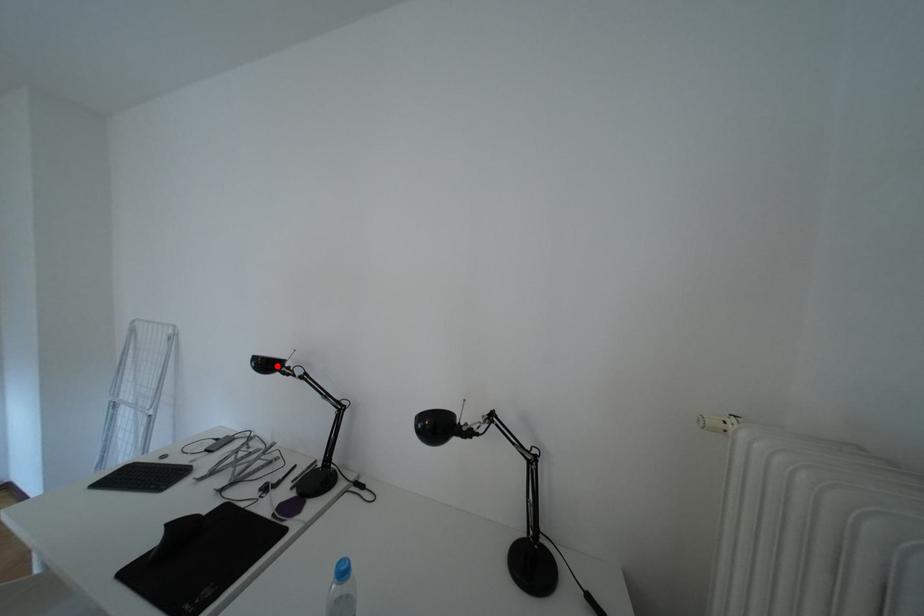
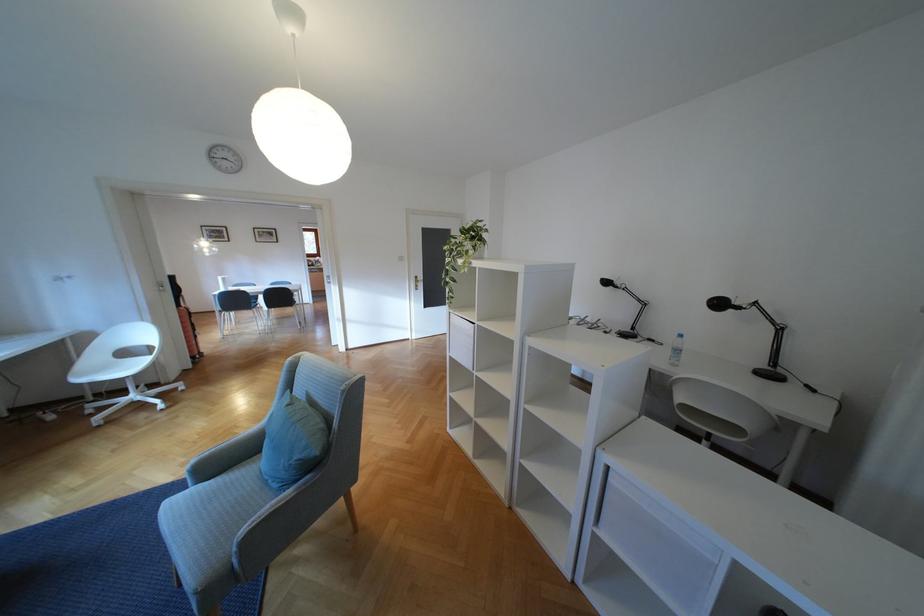
Locate, in the second image, the point that corresponds to the highlighted location in the first image.

(616, 284)